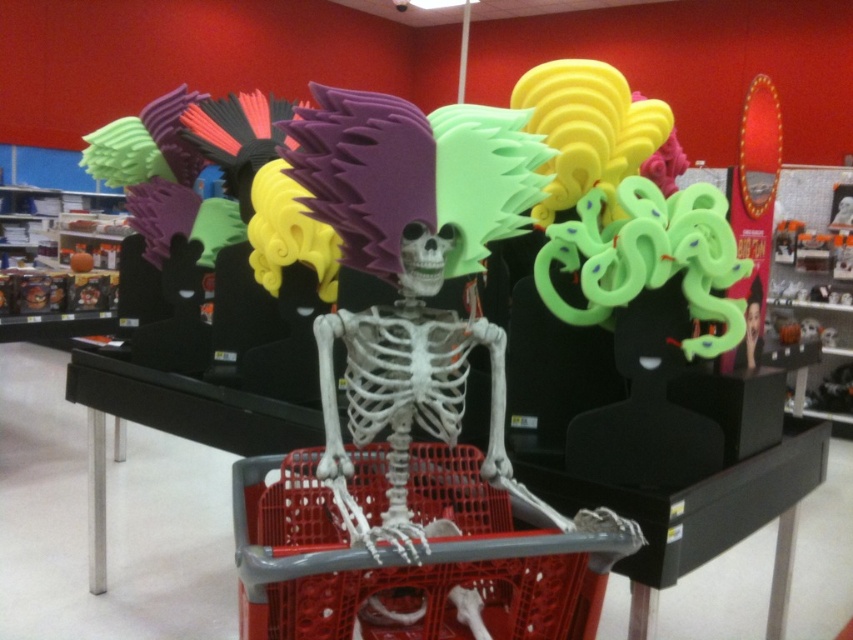
From the picture: You are a customer in the store and want to place a small pumpkin decoration into the red plastic shopping basket at center. However, you notice the smooth plastic skeleton at center is blocking your path. Can you reach the basket without moving the skeleton?

The red plastic shopping basket at center is 32.51 inches away from the smooth plastic skeleton at center. Since the skeleton is blocking your path, you would need to move around it to access the basket. The distance between them suggests there is enough space to maneuver around the skeleton to reach the basket.